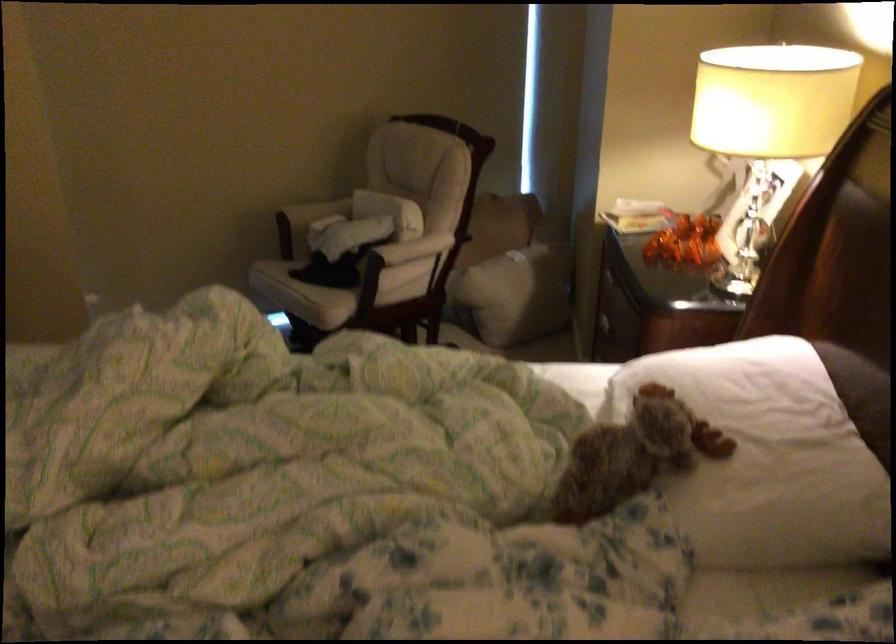
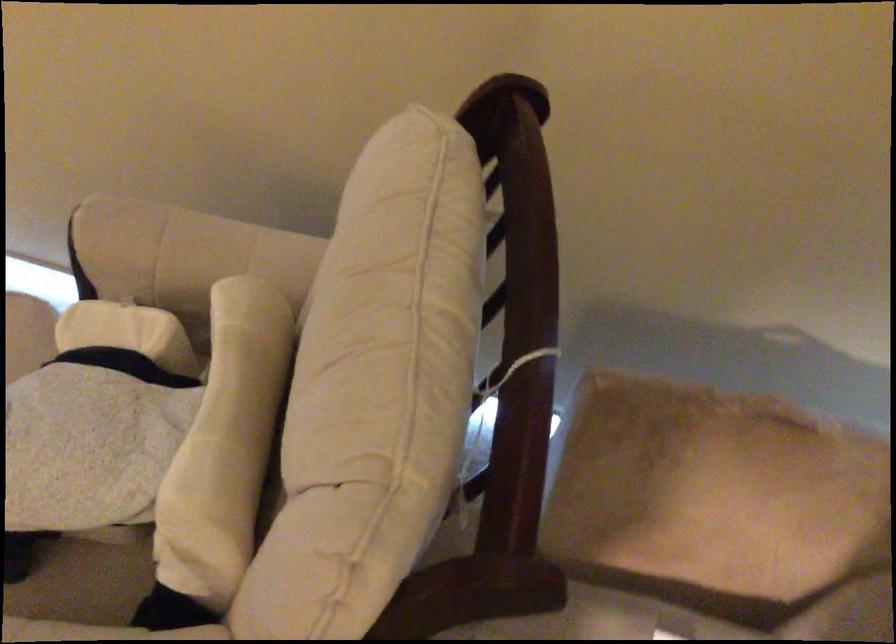
Where in the second image is the point corresponding to (x=316, y=205) from the first image?

(181, 250)